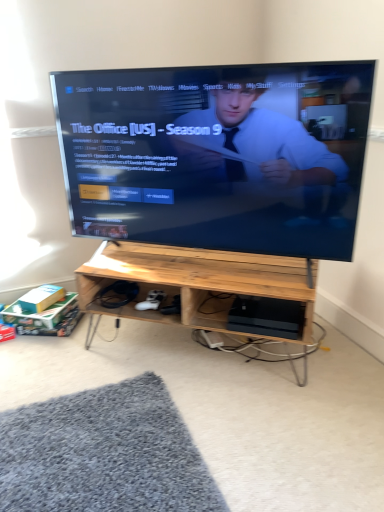
Question: Should I look upward or downward to see black plastic computer at lower center?

Choices:
 (A) down
 (B) up

Answer: (A)

Question: Is black glossy tv at center to the right of black plastic computer at lower center from the viewer's perspective?

Choices:
 (A) yes
 (B) no

Answer: (B)

Question: Does black glossy tv at center come behind black plastic computer at lower center?

Choices:
 (A) no
 (B) yes

Answer: (A)

Question: Can you confirm if black glossy tv at center is bigger than black plastic computer at lower center?

Choices:
 (A) yes
 (B) no

Answer: (A)

Question: Considering the relative sizes of black glossy tv at center and black plastic computer at lower center in the image provided, is black glossy tv at center wider than black plastic computer at lower center?

Choices:
 (A) no
 (B) yes

Answer: (A)

Question: Is black glossy tv at center taller than black plastic computer at lower center?

Choices:
 (A) yes
 (B) no

Answer: (A)

Question: Is black glossy tv at center in contact with black plastic computer at lower center?

Choices:
 (A) yes
 (B) no

Answer: (B)

Question: Is black plastic computer at lower center wider than natural wood desk at center?

Choices:
 (A) yes
 (B) no

Answer: (B)

Question: Is black plastic computer at lower center to the right of natural wood desk at center from the viewer's perspective?

Choices:
 (A) no
 (B) yes

Answer: (B)

Question: From the image's perspective, is black plastic computer at lower center located above natural wood desk at center?

Choices:
 (A) no
 (B) yes

Answer: (A)

Question: From the image's perspective, does black plastic computer at lower center appear lower than natural wood desk at center?

Choices:
 (A) no
 (B) yes

Answer: (B)

Question: Is black plastic computer at lower center bigger than natural wood desk at center?

Choices:
 (A) yes
 (B) no

Answer: (B)

Question: Is black plastic computer at lower center completely or partially outside of natural wood desk at center?

Choices:
 (A) yes
 (B) no

Answer: (B)

Question: From a real-world perspective, does black glossy tv at center stand above natural wood desk at center?

Choices:
 (A) yes
 (B) no

Answer: (A)